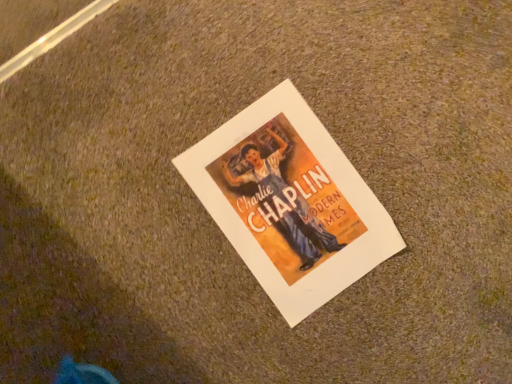
Find the location of a particular element. The width and height of the screenshot is (512, 384). empty space that is ontop of matte paper poster at center (from a real-world perspective) is located at coordinates (285, 201).